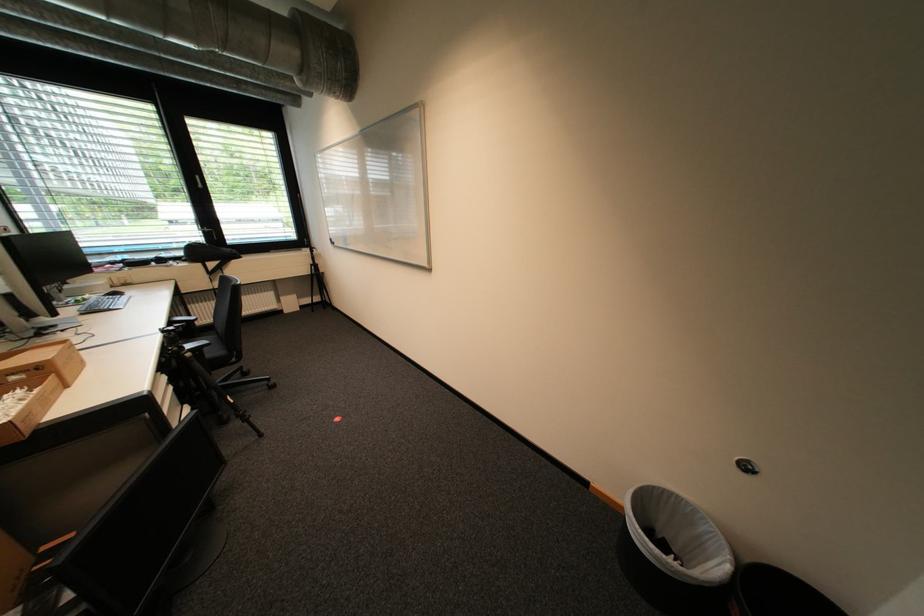
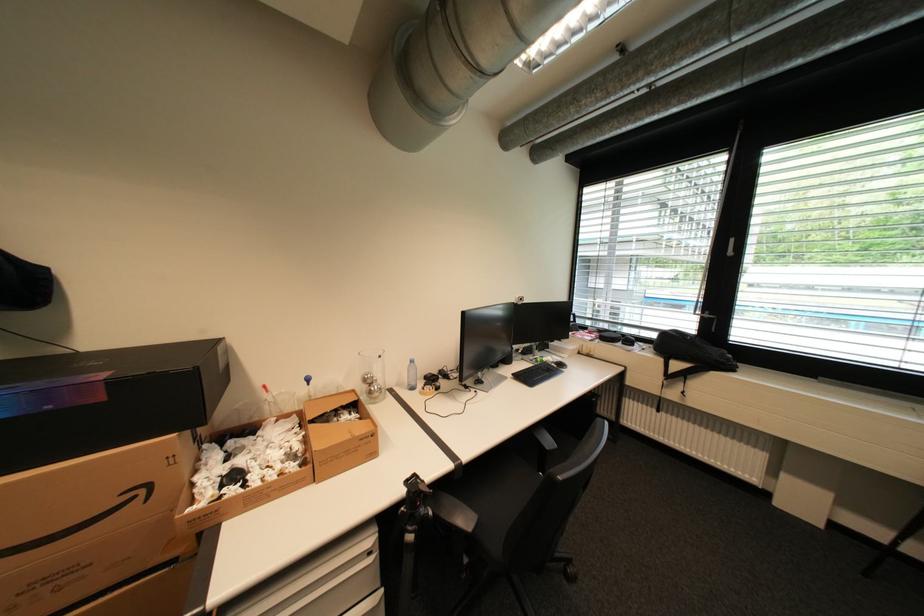
Where in the second image is the point corresponding to (x=220, y=274) from the first image?

(678, 377)